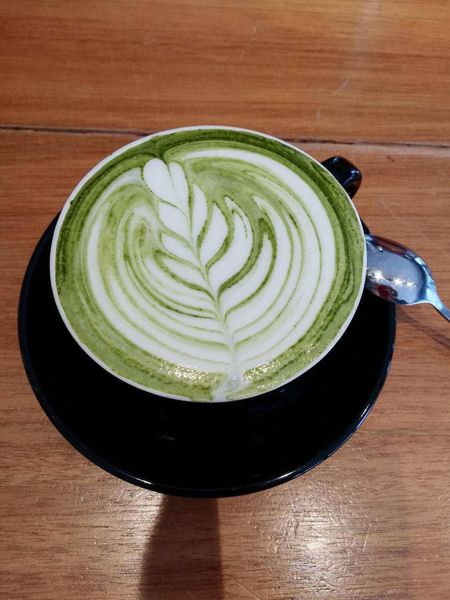
At what (x,y) coordinates should I click in order to perform the action: click on empty space of wood grained table top around cup and saucer. Please return your answer as a coordinate pair (x, y). Image resolution: width=450 pixels, height=600 pixels. Looking at the image, I should click on (245, 64), (383, 455), (45, 515), (306, 546), (37, 168), (56, 41), (417, 199).